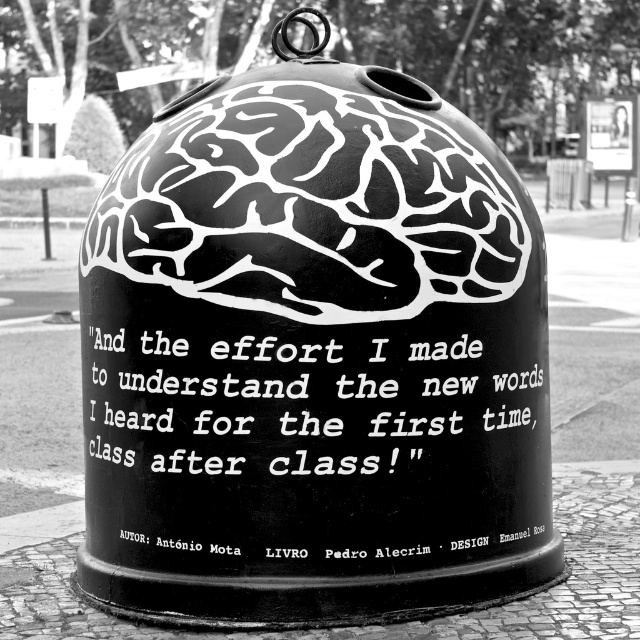
Question: Does white matte text at center appear over black metal pole at left?

Choices:
 (A) yes
 (B) no

Answer: (B)

Question: Which point is farther from the camera taking this photo?

Choices:
 (A) (445, 364)
 (B) (44, 186)

Answer: (B)

Question: Which point is closer to the camera?

Choices:
 (A) (44, 236)
 (B) (403, 468)

Answer: (B)

Question: Is white matte text at center positioned before black metal pole at left?

Choices:
 (A) yes
 (B) no

Answer: (A)

Question: Is white matte text at center above black metal pole at left?

Choices:
 (A) no
 (B) yes

Answer: (A)